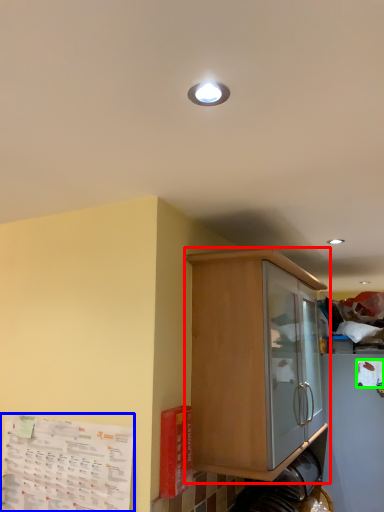
Question: Considering the real-world distances, which object is farthest from cabinetry (highlighted by a red box)? paper (highlighted by a blue box) or paper (highlighted by a green box)?

Choices:
 (A) paper
 (B) paper

Answer: (B)